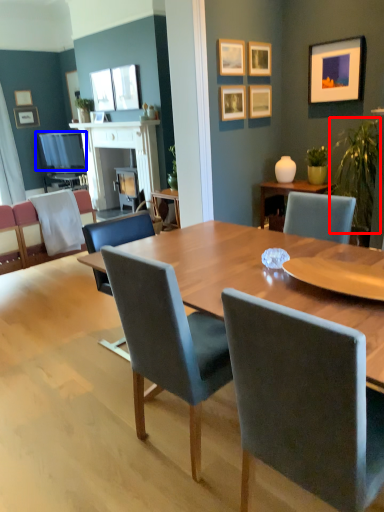
Question: Which object is further to the camera taking this photo, plant (highlighted by a red box) or television (highlighted by a blue box)?

Choices:
 (A) plant
 (B) television

Answer: (B)